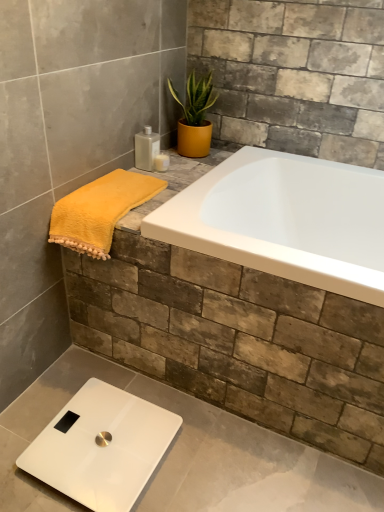
The height and width of the screenshot is (512, 384). Identify the location of empty space that is to the right of translucent plastic bottle at upper center, marked as the 2th toiletry in a right-to-left arrangement. (183, 172).